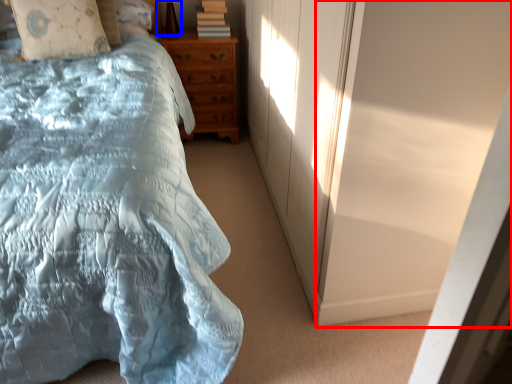
Question: Which of the following is the farthest to the observer, screen door (highlighted by a red box) or table lamp (highlighted by a blue box)?

Choices:
 (A) screen door
 (B) table lamp

Answer: (B)